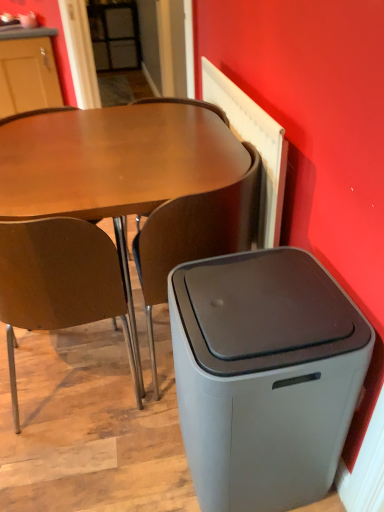
The image size is (384, 512). In order to click on vacant space to the left of gray matte trash bin/can at lower right in this screenshot , I will do `click(134, 458)`.